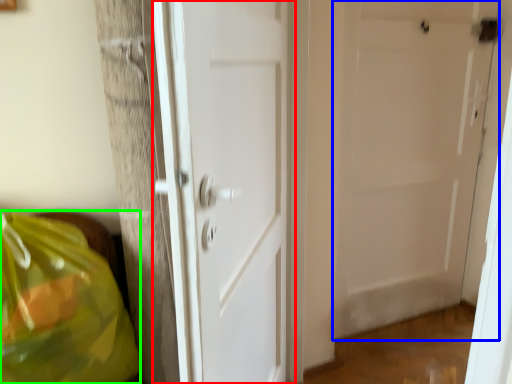
Question: Which object is positioned farthest from door (highlighted by a red box)? Select from door (highlighted by a blue box) and grocery bag (highlighted by a green box).

Choices:
 (A) door
 (B) grocery bag

Answer: (A)